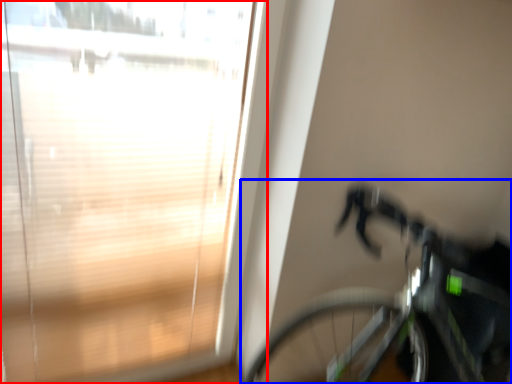
Question: Which point is further to the camera, window (highlighted by a red box) or bicycle (highlighted by a blue box)?

Choices:
 (A) window
 (B) bicycle

Answer: (A)